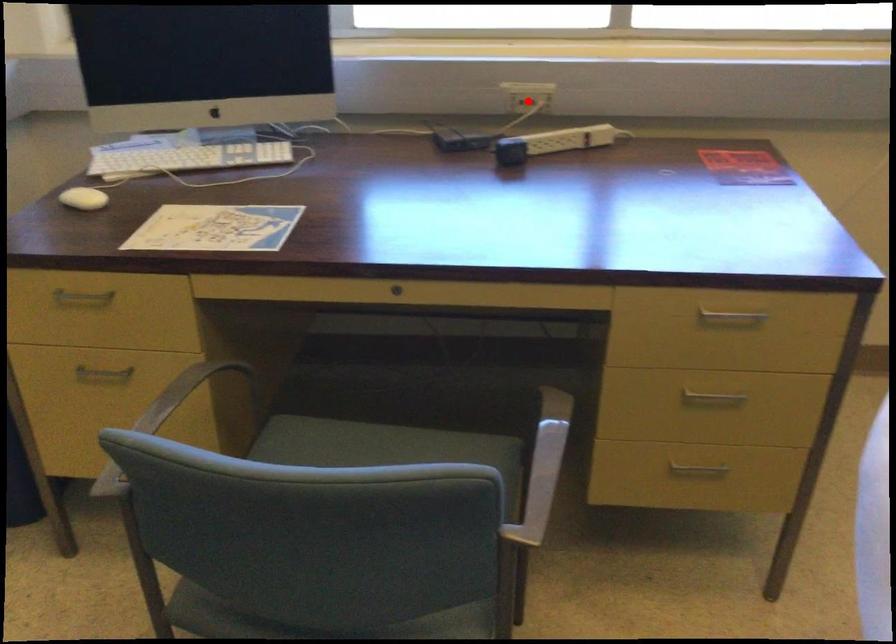
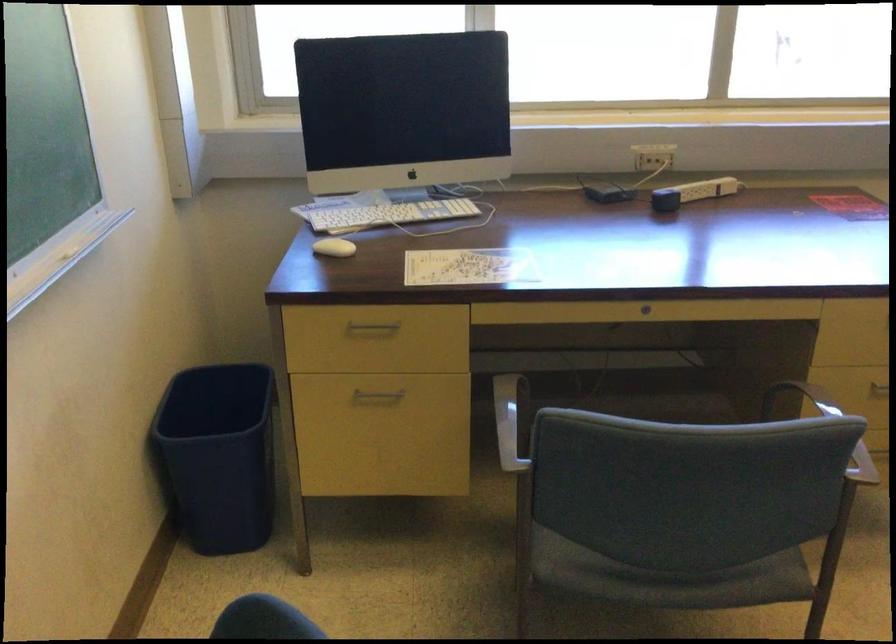
The point at the highlighted location is marked in the first image. Where is the corresponding point in the second image?

(658, 156)